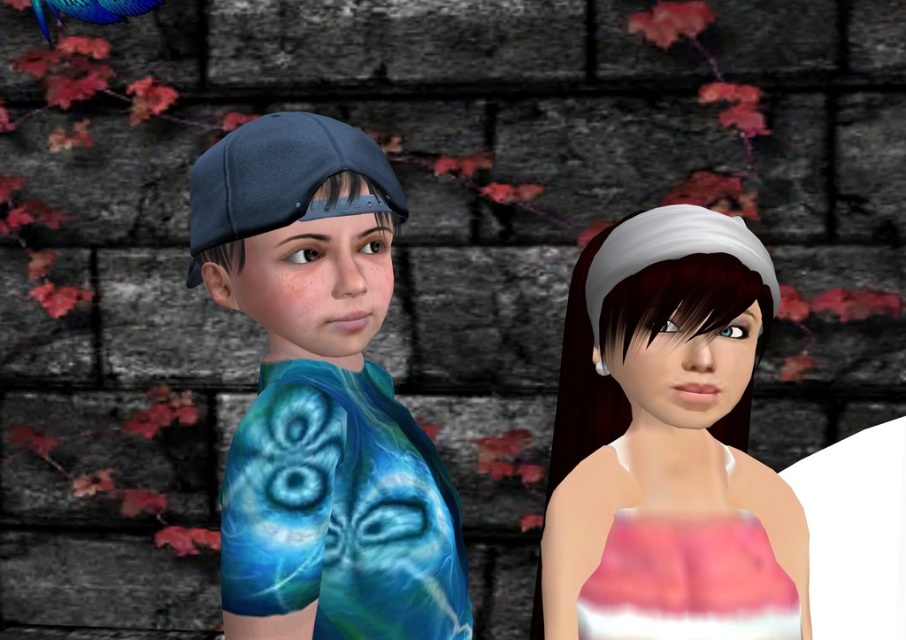
Is blue tie-dye shirt at left thinner than matte blue baseball cap at left?

No.

Is point (275, 250) positioned in front of point (200, 180)?

Yes, it is in front of point (200, 180).

Who is more distant from viewer, (347, 374) or (396, 189)?

Point (347, 374)

Locate an element on the screen. Image resolution: width=906 pixels, height=640 pixels. blue tie-dye shirt at left is located at coordinates (320, 396).

Is point (307, 276) farther from viewer compared to point (606, 412)?

No, it is in front of (606, 412).

Is point (364, 257) in front of point (628, 412)?

Yes, it is.

Image resolution: width=906 pixels, height=640 pixels. I want to click on blue tie-dye shirt at left, so click(320, 396).

Locate an element on the screen. The width and height of the screenshot is (906, 640). white matte hairband at upper right is located at coordinates (659, 394).

Who is positioned more to the right, white matte hairband at upper right or matte blue baseball cap at left?

From the viewer's perspective, white matte hairband at upper right appears more on the right side.

You are a GUI agent. You are given a task and a screenshot of the screen. Output one action in this format:
    pyautogui.click(x=<x>, y=<y>)
    Task: Click on the white matte hairband at upper right
    The image size is (906, 640).
    Given the screenshot: What is the action you would take?
    pyautogui.click(x=659, y=394)

This screenshot has width=906, height=640. Find the location of `white matte hairband at upper right`. white matte hairband at upper right is located at coordinates (659, 394).